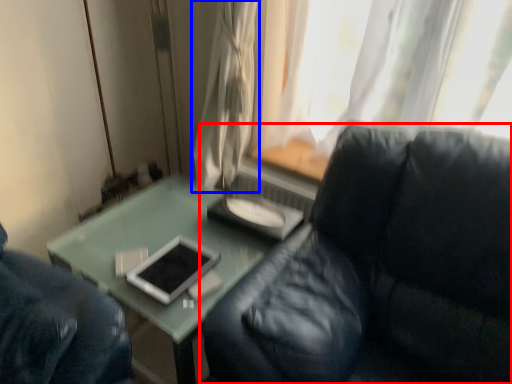
Question: Among these objects, which one is farthest to the camera, studio couch (highlighted by a red box) or curtain (highlighted by a blue box)?

Choices:
 (A) studio couch
 (B) curtain

Answer: (B)